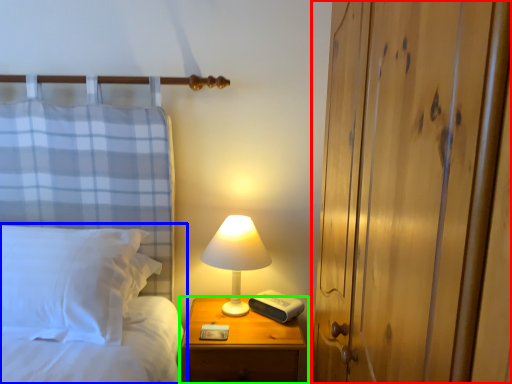
Question: Estimate the real-world distances between objects in this image. Which object is closer to dresser (highlighted by a red box), bed (highlighted by a blue box) or nightstand (highlighted by a green box)?

Choices:
 (A) bed
 (B) nightstand

Answer: (B)